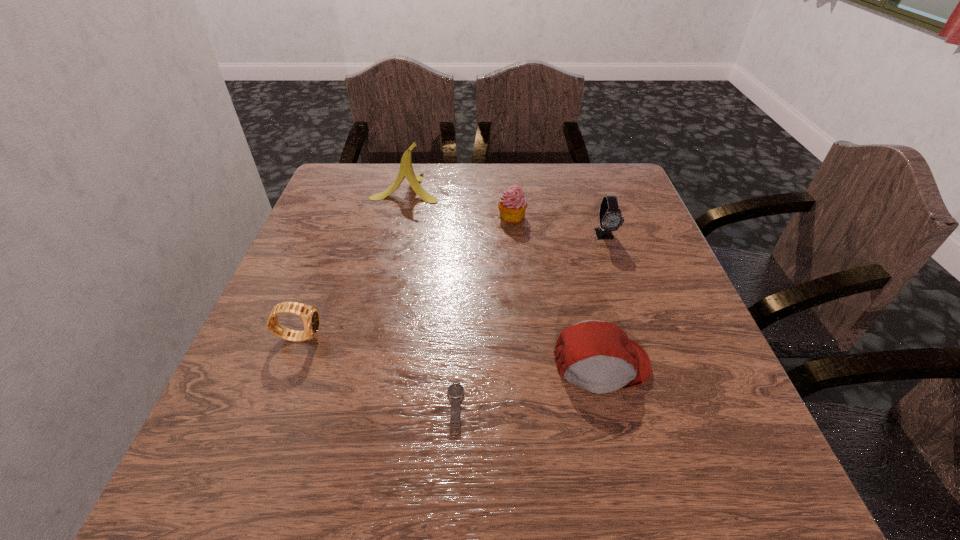
Where is `vacant area between the cap and the tallest watch`? vacant area between the cap and the tallest watch is located at coordinates (603, 300).

Find the location of a particular element. vacant point located between the nearest watch and the second object from left to right is located at coordinates (430, 299).

Find the location of a particular element. vacant area that lies between the leftmost watch and the tallest object is located at coordinates (352, 262).

Where is `empty space that is in between the leftmost object and the cap`? empty space that is in between the leftmost object and the cap is located at coordinates (450, 350).

Image resolution: width=960 pixels, height=540 pixels. What are the coordinates of `vacant space that is in between the fourth object from left to right and the banana` in the screenshot? It's located at (459, 202).

The image size is (960, 540). I want to click on vacant point located between the second nearest watch and the cap, so click(450, 350).

The image size is (960, 540). In order to click on free space between the farthest watch and the cap in this screenshot , I will do `click(603, 300)`.

This screenshot has width=960, height=540. What are the coordinates of `vacant region between the shortest watch and the cap` in the screenshot? It's located at (528, 387).

Locate an element on the screen. free space between the banana and the cap is located at coordinates (504, 276).

Identify the location of object that ranks as the closest to the banana. Image resolution: width=960 pixels, height=540 pixels. (512, 206).